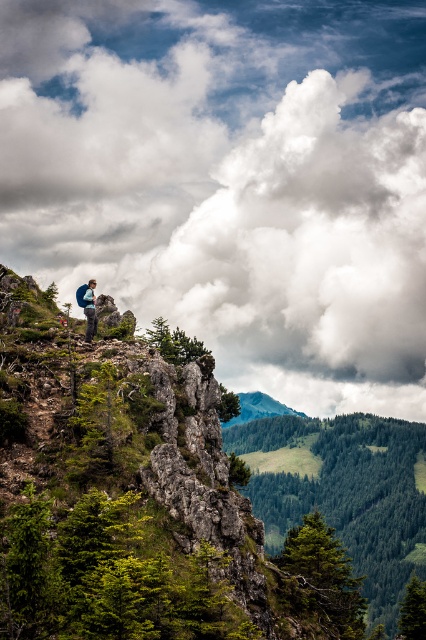
You are a photographer planning to take a photo of the matte blue backpack at center and the white fluffy cloud at upper center. Which object should you focus on first if you want to capture both in sharp detail?

The matte blue backpack at center is closer to you than the white fluffy cloud at upper center, so you should focus on the matte blue backpack at center first to ensure both are in focus.

You are a photographer standing at the edge of the cliff in the mountainous landscape. You want to capture a photo that includes both the point at coordinates point (48, 134) and point (290, 410). Which point should you focus on first to ensure both are in the frame?

You should focus on point (48, 134) first because it is closer to you than point (290, 410), allowing both points to be captured within the frame.